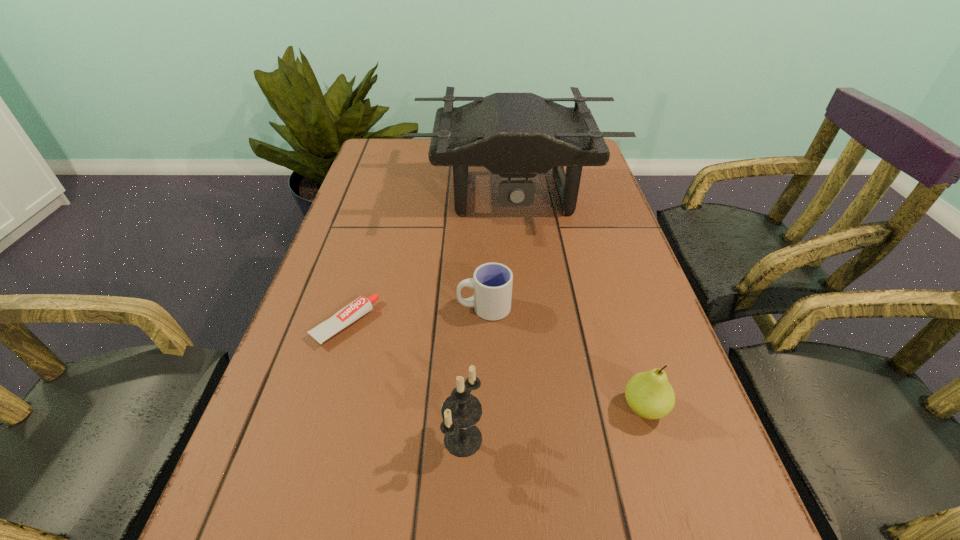
Identify the location of object identified as the closest to the pear. This screenshot has height=540, width=960. (492, 282).

Identify the location of free location that satisfies the following two spatial constraints: 1. with the handle on the side of the second shortest object; 2. on the front side of the shortest object. Image resolution: width=960 pixels, height=540 pixels. (x=484, y=323).

Find the location of `free space that satisfies the following two spatial constraints: 1. with a camera mounted on the underside of the drone; 2. with the handle on the side of the fourth tallest object`. free space that satisfies the following two spatial constraints: 1. with a camera mounted on the underside of the drone; 2. with the handle on the side of the fourth tallest object is located at coordinates (524, 308).

The image size is (960, 540). Identify the location of vacant point that satisfies the following two spatial constraints: 1. with the handle on the side of the pear; 2. on the right side of the cup. (485, 408).

Where is `free space that satisfies the following two spatial constraints: 1. with a camera mounted on the underside of the farthest object; 2. with the handle on the side of the cup`? Image resolution: width=960 pixels, height=540 pixels. free space that satisfies the following two spatial constraints: 1. with a camera mounted on the underside of the farthest object; 2. with the handle on the side of the cup is located at coordinates (524, 308).